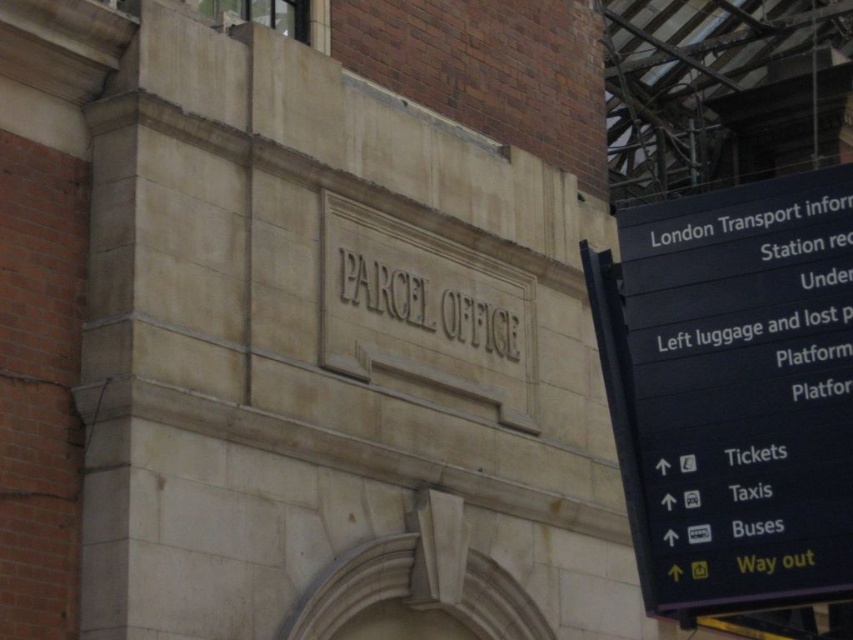
You are standing in front of the building and looking at the two points marked on the image. Which point, point (788, 401) or point (399, 285), is closer to you?

Point (788, 401) is closer to the camera than point (399, 285).

You are a delivery person trying to read the signs on the building. Which sign, the black plastic sign at right or the matte stone sign at center, is larger in size?

The black plastic sign at right is bigger than the matte stone sign at center.

You are standing in front of the building and want to read both the black plastic sign at right and the matte stone sign at center. How far apart are these two signs?

The black plastic sign at right and the matte stone sign at center are 16.41 meters apart from each other.